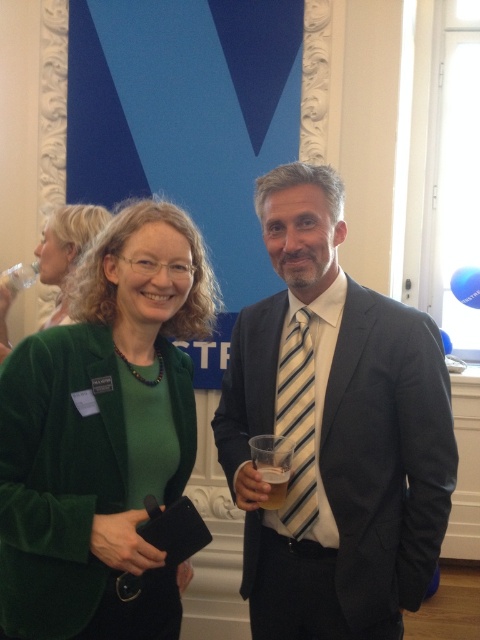
Question: Which point is closer to the camera taking this photo?

Choices:
 (A) (92, 205)
 (B) (297, 394)
 (C) (11, 554)

Answer: (C)

Question: Which object is closer to the camera taking this photo?

Choices:
 (A) striped fabric tie at center
 (B) translucent plastic cup at center

Answer: (B)

Question: Can you confirm if striped silk tie at center is wider than translucent plastic cup at center?

Choices:
 (A) no
 (B) yes

Answer: (B)

Question: Can you confirm if velvet green blazer at center is smaller than striped fabric tie at center?

Choices:
 (A) no
 (B) yes

Answer: (A)

Question: Is velvet green blazer at center further to camera compared to translucent plastic cup at center?

Choices:
 (A) yes
 (B) no

Answer: (B)

Question: Which of the following is the farthest from the observer?

Choices:
 (A) (305, 369)
 (B) (317, 604)
 (C) (279, 474)

Answer: (A)